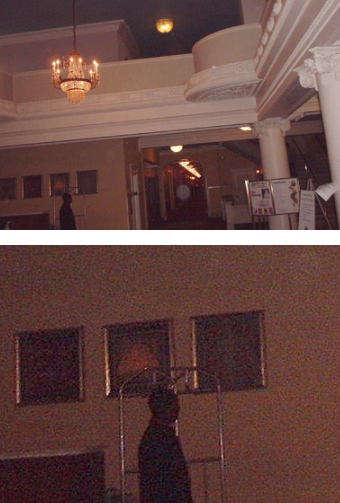
Find the location of `walls in lights`. walls in lights is located at coordinates (248, 127), (202, 180), (197, 174), (188, 167), (181, 165), (172, 152).